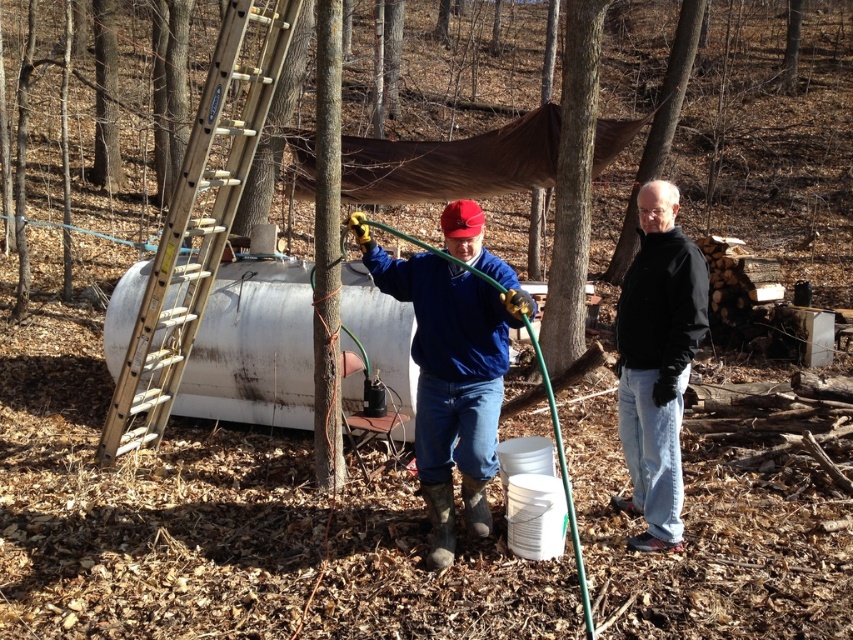
Question: Among these points, which one is nearest to the camera?

Choices:
 (A) (180, 234)
 (B) (585, 113)

Answer: (A)

Question: Estimate the real-world distances between objects in this image. Which object is closer to the wooden ladder at left?

Choices:
 (A) black matte jacket at center
 (B) rough bark tree at center
 (C) blue matte jacket at center
 (D) brown rough bark at upper center

Answer: (C)

Question: Which of the following is the closest to the observer?

Choices:
 (A) brown rough bark at upper center
 (B) black matte jacket at center
 (C) rough bark tree at center

Answer: (B)

Question: Does rough bark tree at center come in front of brown rough bark at upper center?

Choices:
 (A) yes
 (B) no

Answer: (A)

Question: Does wooden ladder at left have a larger size compared to black matte jacket at center?

Choices:
 (A) no
 (B) yes

Answer: (B)

Question: Considering the relative positions of blue matte jacket at center and rough bark tree at center in the image provided, where is blue matte jacket at center located with respect to rough bark tree at center?

Choices:
 (A) right
 (B) left

Answer: (B)